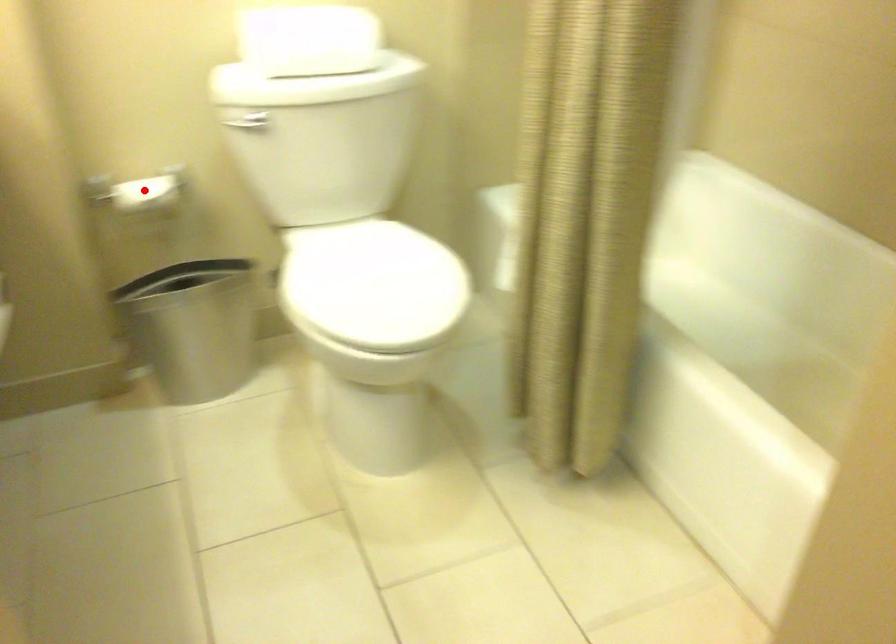
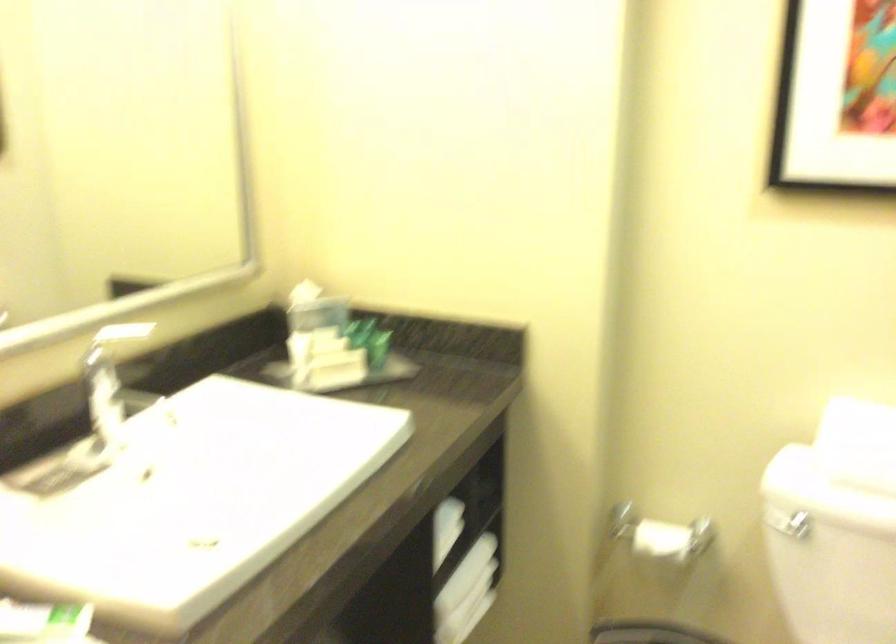
Locate, in the second image, the point that corresponds to the highlighted location in the first image.

(660, 540)